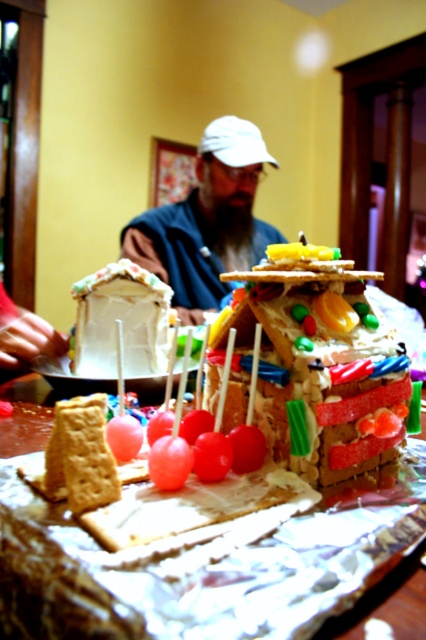
Which of these two, matte white cap at center or matte brown gingerbread at lower left, stands shorter?

With less height is matte brown gingerbread at lower left.

Looking at this image, does matte white cap at center come behind matte brown gingerbread at lower left?

That is True.

Is point (135, 243) in front of point (81, 403)?

That is False.

Find the location of a particular element. The width and height of the screenshot is (426, 640). matte white cap at center is located at coordinates (207, 221).

Between shiny aluminum foil at center and matte white cap at center, which one appears on the right side from the viewer's perspective?

From the viewer's perspective, matte white cap at center appears more on the right side.

Who is more distant from viewer, (287,536) or (138,234)?

Positioned behind is point (138,234).

Is point (215, 625) positioned before point (265, 244)?

Yes, it is in front of point (265, 244).

You are a GUI agent. You are given a task and a screenshot of the screen. Output one action in this format:
    pyautogui.click(x=<x>, y=<y>)
    Task: Click on the shiny aluminum foil at center
    This screenshot has width=426, height=640.
    Given the screenshot: What is the action you would take?
    pyautogui.click(x=198, y=563)

The height and width of the screenshot is (640, 426). Describe the element at coordinates (198, 563) in the screenshot. I see `shiny aluminum foil at center` at that location.

Image resolution: width=426 pixels, height=640 pixels. What do you see at coordinates (198, 563) in the screenshot? I see `shiny aluminum foil at center` at bounding box center [198, 563].

Where is `shiny aluminum foil at center`? The height and width of the screenshot is (640, 426). shiny aluminum foil at center is located at coordinates pyautogui.click(x=198, y=563).